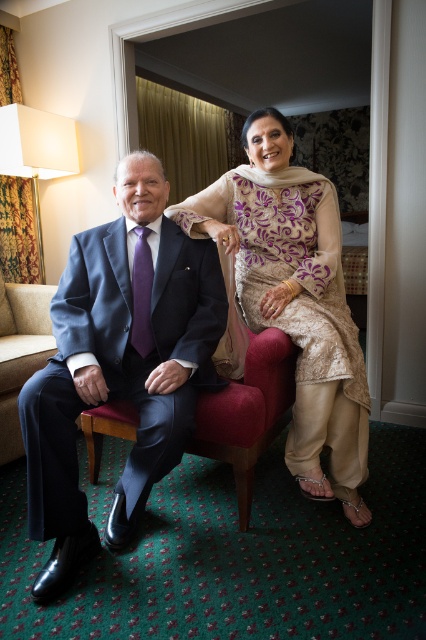
Can you confirm if beige lace dress at center is smaller than suede couch at lower left?

Actually, beige lace dress at center might be larger than suede couch at lower left.

The image size is (426, 640). I want to click on beige lace dress at center, so click(294, 298).

Between point (131, 451) and point (259, 301), which one is positioned in front?

Point (131, 451)

Is matte blue suit at left smaller than beige lace dress at center?

Yes.

Measure the distance between point (126, 464) and camera.

They are 1.61 meters apart.

Locate an element on the screen. matte blue suit at left is located at coordinates (120, 364).

Can you confirm if matte blue suit at left is positioned to the left of suede couch at lower left?

Incorrect, matte blue suit at left is not on the left side of suede couch at lower left.

Is matte blue suit at left below suede couch at lower left?

Incorrect, matte blue suit at left is not positioned below suede couch at lower left.

Image resolution: width=426 pixels, height=640 pixels. I want to click on matte blue suit at left, so pos(120,364).

Identify the location of matte blue suit at left. The width and height of the screenshot is (426, 640). (120, 364).